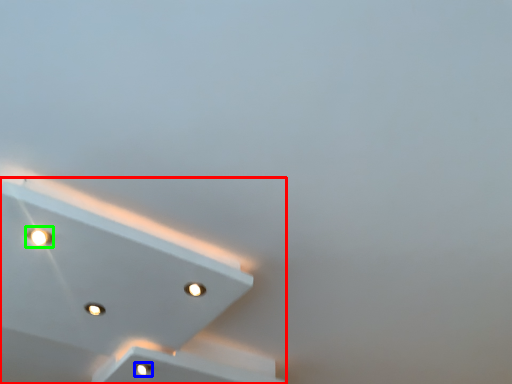
Question: Which object is positioned farthest from lamp (highlighted by a red box)? Select from dot (highlighted by a blue box) and dot (highlighted by a green box).

Choices:
 (A) dot
 (B) dot

Answer: (B)